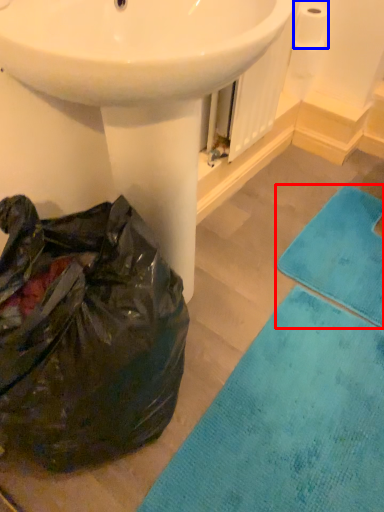
Question: Which object appears closest to the camera in this image, bath towel (highlighted by a red box) or toilet paper (highlighted by a blue box)?

Choices:
 (A) bath towel
 (B) toilet paper

Answer: (A)